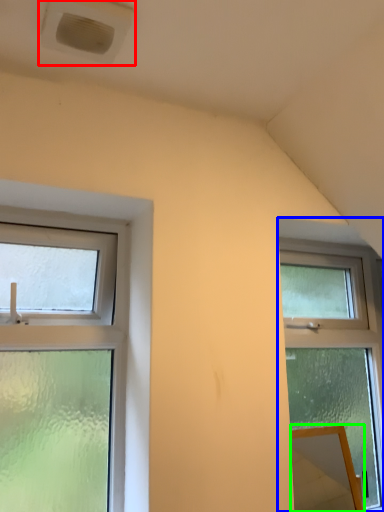
Question: Which is nearer to the air conditioning (highlighted by a red box)? window (highlighted by a blue box) or mirror (highlighted by a green box).

Choices:
 (A) window
 (B) mirror

Answer: (A)